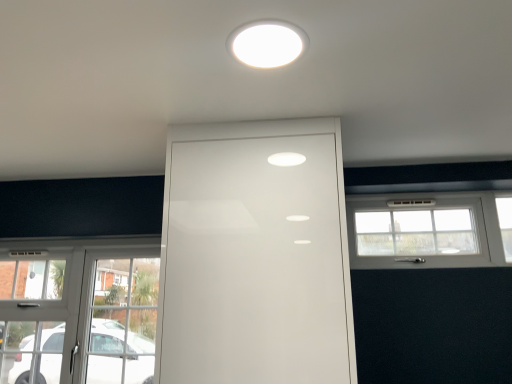
Question: Could you tell me if white glossy light fixture at upper center is turned towards clear glass door at lower left, which is the second window from top to bottom?

Choices:
 (A) yes
 (B) no

Answer: (B)

Question: Does white glossy light fixture at upper center have a smaller size compared to clear glass door at lower left, the 1th window positioned from the bottom?

Choices:
 (A) yes
 (B) no

Answer: (A)

Question: Would you consider white glossy light fixture at upper center to be distant from clear glass door at lower left, which appears as the first window when viewed from the left?

Choices:
 (A) no
 (B) yes

Answer: (B)

Question: Does white glossy light fixture at upper center have a lesser height compared to clear glass door at lower left, which is the second window from top to bottom?

Choices:
 (A) yes
 (B) no

Answer: (A)

Question: Is white glossy light fixture at upper center beside clear glass door at lower left, which appears as the first window when viewed from the left?

Choices:
 (A) yes
 (B) no

Answer: (B)

Question: Do you think white glossy door at center is within clear glass door at lower left, the 1th window positioned from the bottom, or outside of it?

Choices:
 (A) inside
 (B) outside

Answer: (B)

Question: From a real-world perspective, is white glossy door at center physically located above or below clear glass door at lower left, which appears as the first window when viewed from the left?

Choices:
 (A) above
 (B) below

Answer: (A)

Question: From the image's perspective, relative to clear glass door at lower left, which is the second window from top to bottom, is white glossy door at center above or below?

Choices:
 (A) below
 (B) above

Answer: (B)

Question: Considering the positions of point (245, 322) and point (111, 304), is point (245, 322) closer or farther from the camera than point (111, 304)?

Choices:
 (A) closer
 (B) farther

Answer: (A)

Question: Is white plastic window at right, which is counted as the 2th window, starting from the left, in front of or behind white glossy light fixture at upper center in the image?

Choices:
 (A) front
 (B) behind

Answer: (B)

Question: Does point click(x=484, y=216) appear closer or farther from the camera than point click(x=270, y=31)?

Choices:
 (A) closer
 (B) farther

Answer: (B)

Question: Is white plastic window at right, which is counted as the 2th window, starting from the left, inside the boundaries of white glossy light fixture at upper center, or outside?

Choices:
 (A) inside
 (B) outside

Answer: (B)

Question: In terms of height, does white plastic window at right, which is counted as the 2th window, starting from the left, look taller or shorter compared to white glossy light fixture at upper center?

Choices:
 (A) tall
 (B) short

Answer: (A)

Question: Is white glossy door at center bigger or smaller than white glossy light fixture at upper center?

Choices:
 (A) small
 (B) big

Answer: (B)

Question: Would you say white glossy door at center is to the left or to the right of white glossy light fixture at upper center in the picture?

Choices:
 (A) right
 (B) left

Answer: (B)